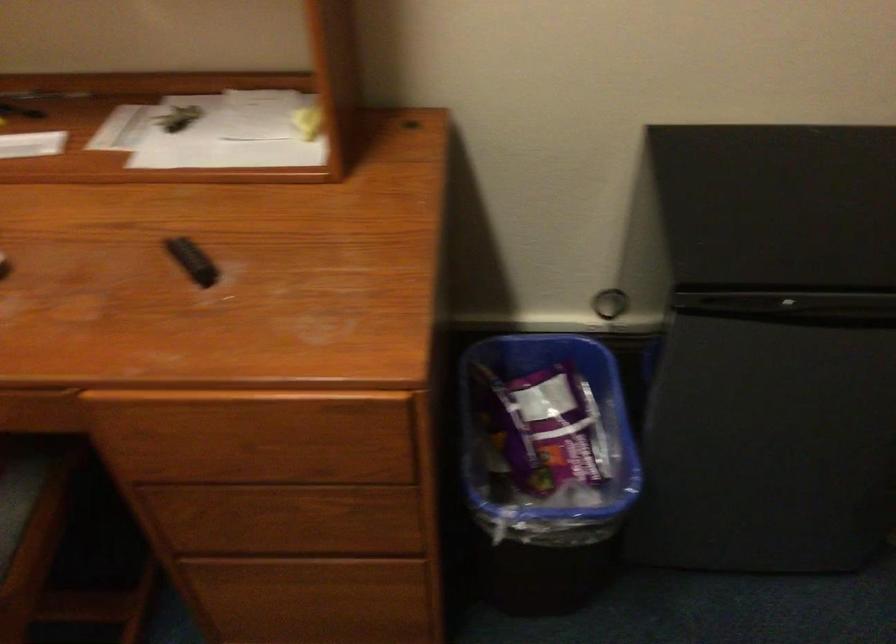
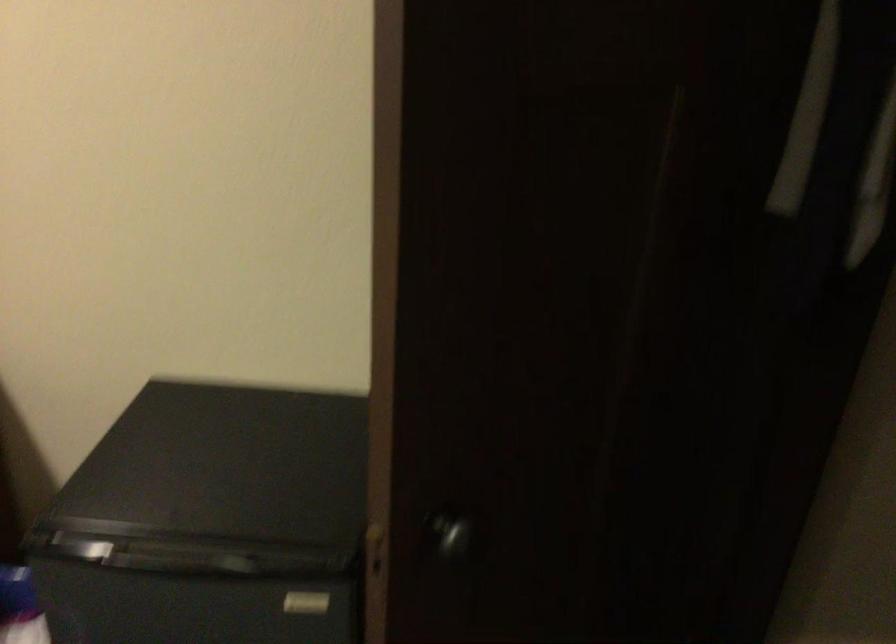
Question: The first image is from the beginning of the video and the second image is from the end. How did the camera likely rotate when shooting the video?

Choices:
 (A) Left
 (B) Right
 (C) Up
 (D) Down

Answer: (C)